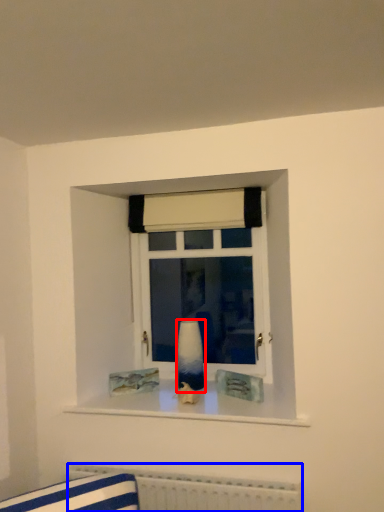
Question: Which point is further to the camera, vase (highlighted by a red box) or radiator (highlighted by a blue box)?

Choices:
 (A) vase
 (B) radiator

Answer: (A)